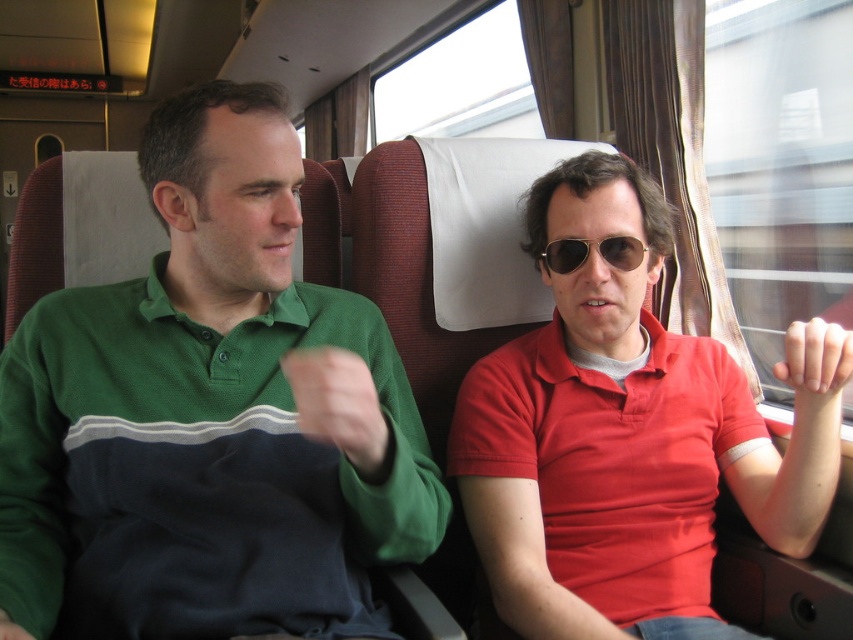
Does green cotton shirt at left have a lesser width compared to metallic aviator sunglasses at center?

Incorrect, green cotton shirt at left's width is not less than metallic aviator sunglasses at center's.

The height and width of the screenshot is (640, 853). What do you see at coordinates (209, 417) in the screenshot? I see `green cotton shirt at left` at bounding box center [209, 417].

The width and height of the screenshot is (853, 640). I want to click on green cotton shirt at left, so click(209, 417).

Can you confirm if matte red polo shirt at center is taller than metallic aviator sunglasses at center?

Yes, matte red polo shirt at center is taller than metallic aviator sunglasses at center.

Locate an element on the screen. matte red polo shirt at center is located at coordinates (619, 440).

Is point (598, 506) farther from camera compared to point (604, 259)?

No.

The width and height of the screenshot is (853, 640). What are the coordinates of `matte red polo shirt at center` in the screenshot? It's located at (619, 440).

Between point (686, 563) and point (827, 333), which one is positioned behind?

The point (686, 563) is more distant.

Can you confirm if matte red polo shirt at center is bigger than smooth skin hand at center right?

Correct, matte red polo shirt at center is larger in size than smooth skin hand at center right.

Who is more distant from viewer, [509,428] or [786,342]?

Positioned behind is point [509,428].

The height and width of the screenshot is (640, 853). Find the location of `matte red polo shirt at center`. matte red polo shirt at center is located at coordinates (619, 440).